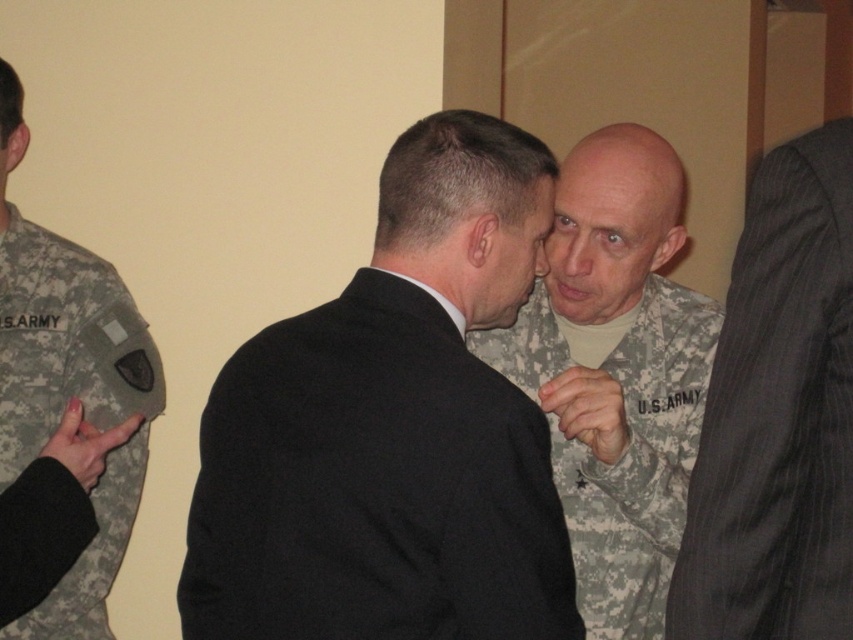
Which is above, camouflage fabric us army uniform at center or camouflage fabric us army uniform at left?

camouflage fabric us army uniform at left is above.

Does camouflage fabric us army uniform at center appear under camouflage fabric us army uniform at left?

Indeed, camouflage fabric us army uniform at center is positioned under camouflage fabric us army uniform at left.

This screenshot has height=640, width=853. Find the location of `camouflage fabric us army uniform at center`. camouflage fabric us army uniform at center is located at coordinates (614, 372).

Does point (735, 518) come farther from viewer compared to point (57, 301)?

No, it is not.

What are the coordinates of `black pinstripe suit at right` in the screenshot? It's located at (778, 416).

Does point (747, 509) come behind point (646, 332)?

No, it is in front of (646, 332).

Does black pinstripe suit at right appear under camouflage fabric us army uniform at center?

No, black pinstripe suit at right is not below camouflage fabric us army uniform at center.

Is point (706, 596) farther from viewer compared to point (670, 237)?

No, it is in front of (670, 237).

Identify the location of black pinstripe suit at right. The height and width of the screenshot is (640, 853). (778, 416).